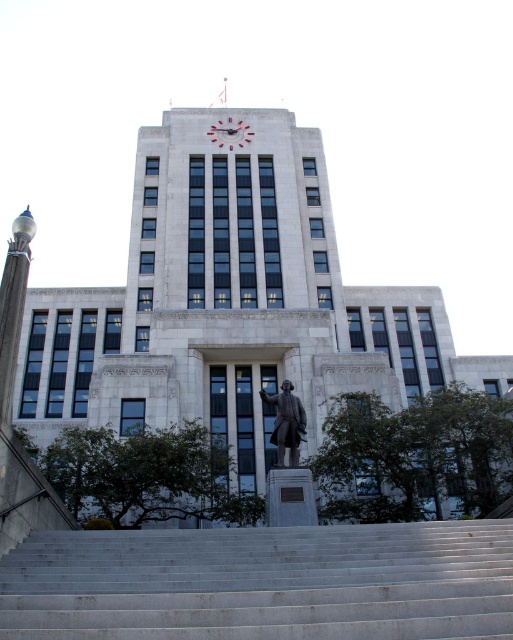
Does white marble stairs at lower center have a greater height compared to bronze statue at center?

No, white marble stairs at lower center is not taller than bronze statue at center.

Which of these two, white marble stairs at lower center or bronze statue at center, stands shorter?

Standing shorter between the two is white marble stairs at lower center.

At what (x,y) coordinates should I click in order to perform the action: click on white marble stairs at lower center. Please return your answer as a coordinate pair (x, y). Looking at the image, I should click on (263, 582).

Locate an element on the screen. The image size is (513, 640). white marble stairs at lower center is located at coordinates (263, 582).